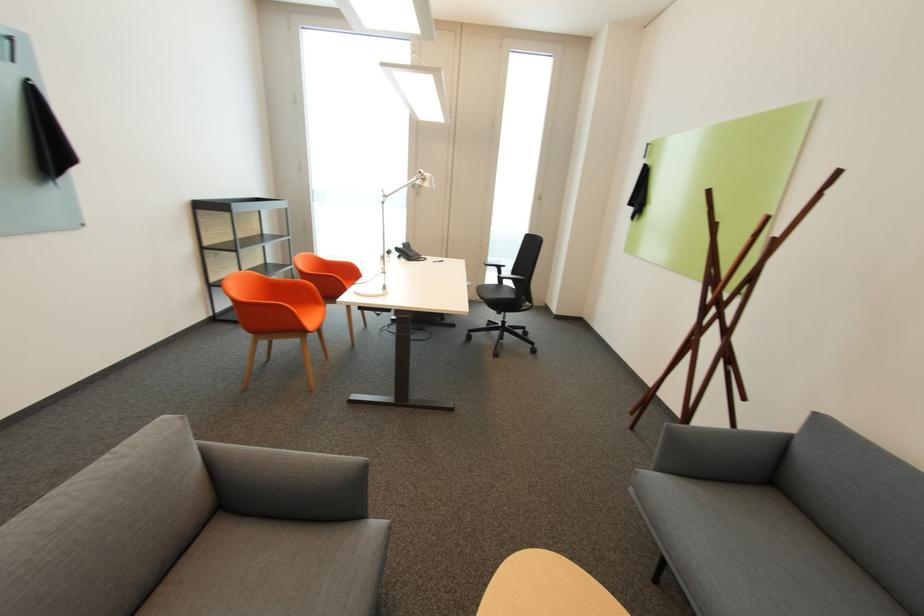
Describe the element at coordinates (46, 135) in the screenshot. I see `a black wall hook` at that location.